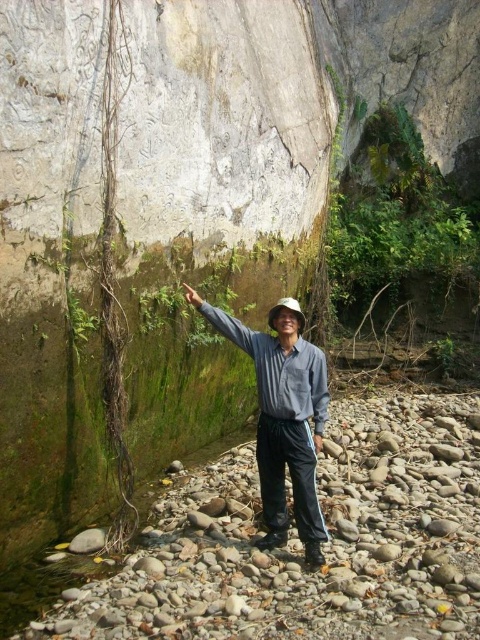
Is gray smooth rocks at lower right smaller than gray cotton shirt at center?

Correct, gray smooth rocks at lower right occupies less space than gray cotton shirt at center.

Between point (417, 602) and point (288, 342), which one is positioned in front?

Positioned in front is point (417, 602).

Is point (372, 403) more distant than point (291, 364)?

Yes, point (372, 403) is behind point (291, 364).

The height and width of the screenshot is (640, 480). I want to click on gray smooth rocks at lower right, so pyautogui.click(x=299, y=545).